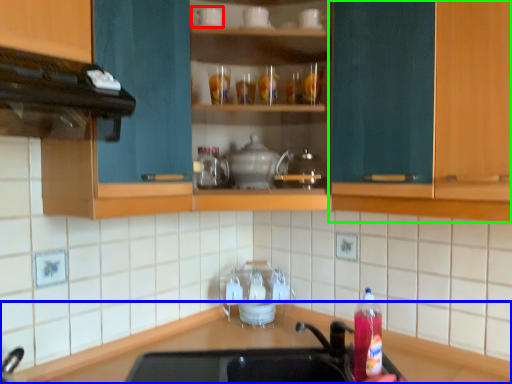
Question: Estimate the real-world distances between objects in this image. Which object is farther from appliance (highlighted by a red box), countertop (highlighted by a blue box) or cabinetry (highlighted by a green box)?

Choices:
 (A) countertop
 (B) cabinetry

Answer: (A)